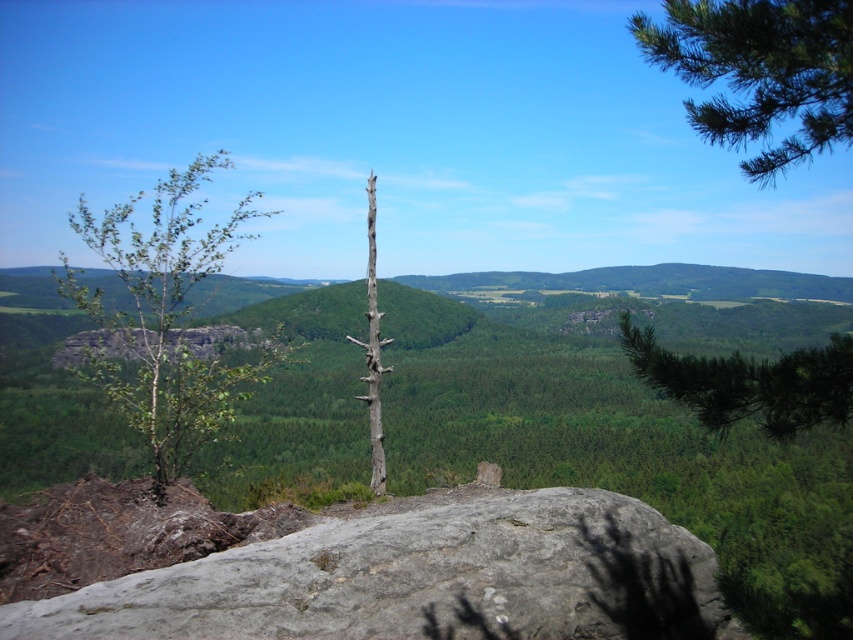
You are a hiker who wants to take a photo of the landscape. You notice the green leafy tree at left and the bare wood tree at center. Which tree is closer to you when standing at the viewpoint?

The green leafy tree at left is closer to you because it is positioned in front of the bare wood tree at center.

You are a photographer standing at the edge of a cliff overlooking the landscape. You want to capture a closeup shot of the gray rough rock at center without including any other objects in the frame. Given that your camera has a minimum focusing distance of 3 meters, will you be able to take this photo?

The gray rough rock at center is 4.49 meters from camera, which is beyond the camera minimum focusing distance of 3 meters. Therefore, you can take the closeup shot without any issues.